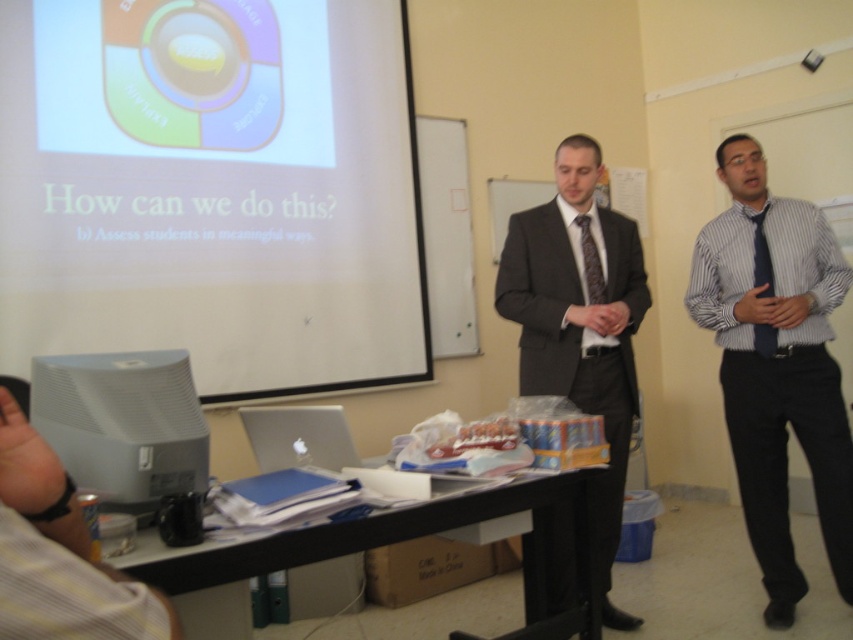
You are a student sitting in the classroom and want to ask a question to the person in the dark gray suit at center. To approach them, you need to walk around the table cluttered with items. Which direction should you go relative to the blue striped shirt at right?

The dark gray suit at center is behind the blue striped shirt at right, so you should go behind the blue striped shirt at right to reach the dark gray suit at center.

You are a student trying to locate the white plastic computer at lower left in the classroom. According to the coordinates given, where exactly is it positioned on the image?

The white plastic computer at lower left is positioned at the 2D coordinates point [123,422].

Based on the photo, you are a student who needs to present using the white plastic computer at lower left. The camera is positioned to capture the presenter. If you move the computer closer to the camera by 2 feet, will it still be in frame?

The white plastic computer at lower left is currently 4.83 feet away from the camera. Moving it closer by 2 feet would bring it to 2.83 feet away. Since the camera is positioned to capture the presenter, moving the computer closer might place it within the camera frame, assuming the camera has a wide enough angle to include objects at that distance. However, without knowing the camera lens specifications, it is uncertain. But based on typical classroom setups, the computer would likely remain in frame as it